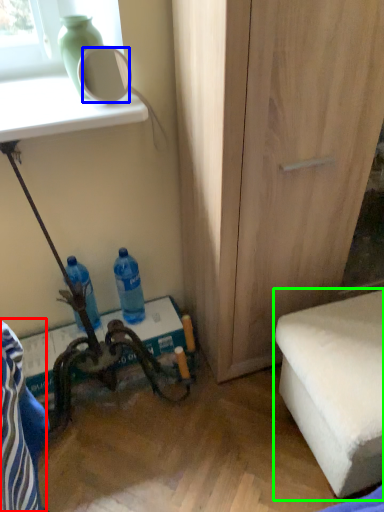
Question: Estimate the real-world distances between objects in this image. Which object is farther from swivel chair (highlighted by a red box), mirror (highlighted by a blue box) or furniture (highlighted by a green box)?

Choices:
 (A) mirror
 (B) furniture

Answer: (A)